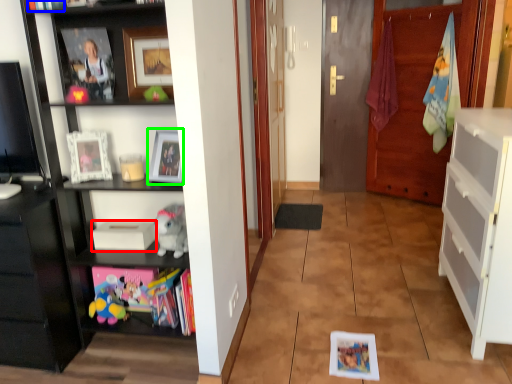
Question: Which object is the closest to the book (highlighted by a red box)? Choose among these: book (highlighted by a blue box) or picture frame (highlighted by a green box).

Choices:
 (A) book
 (B) picture frame

Answer: (B)